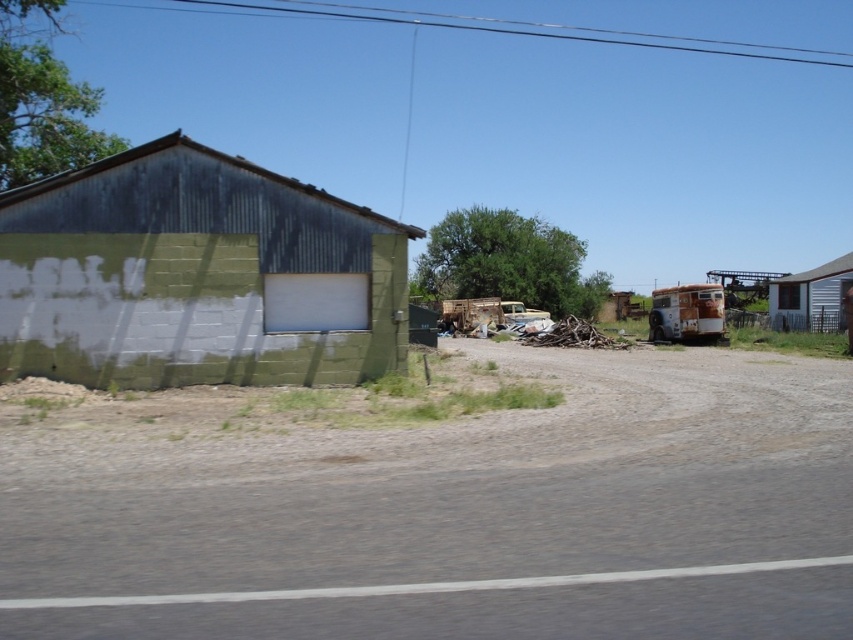
Between green corrugated metal building at left and white wood cabin at right, which one is positioned lower?

green corrugated metal building at left is below.

Does green corrugated metal building at left have a lesser width compared to white wood cabin at right?

No.

Does point (152, 236) come closer to viewer compared to point (791, 314)?

Yes.

I want to click on green corrugated metal building at left, so click(x=196, y=275).

Does dirt/gravel road at center have a greater height compared to green corrugated metal building at left?

Incorrect, dirt/gravel road at center's height is not larger of green corrugated metal building at left's.

Does dirt/gravel road at center appear over green corrugated metal building at left?

Actually, dirt/gravel road at center is below green corrugated metal building at left.

This screenshot has width=853, height=640. I want to click on dirt/gravel road at center, so click(457, 513).

Who is lower down, dirt/gravel road at center or white wood cabin at right?

dirt/gravel road at center

Is dirt/gravel road at center further to the viewer compared to white wood cabin at right?

That is False.

Who is more distant from viewer, (674,413) or (827,308)?

Positioned behind is point (827,308).

Locate an element on the screen. The height and width of the screenshot is (640, 853). dirt/gravel road at center is located at coordinates (457, 513).